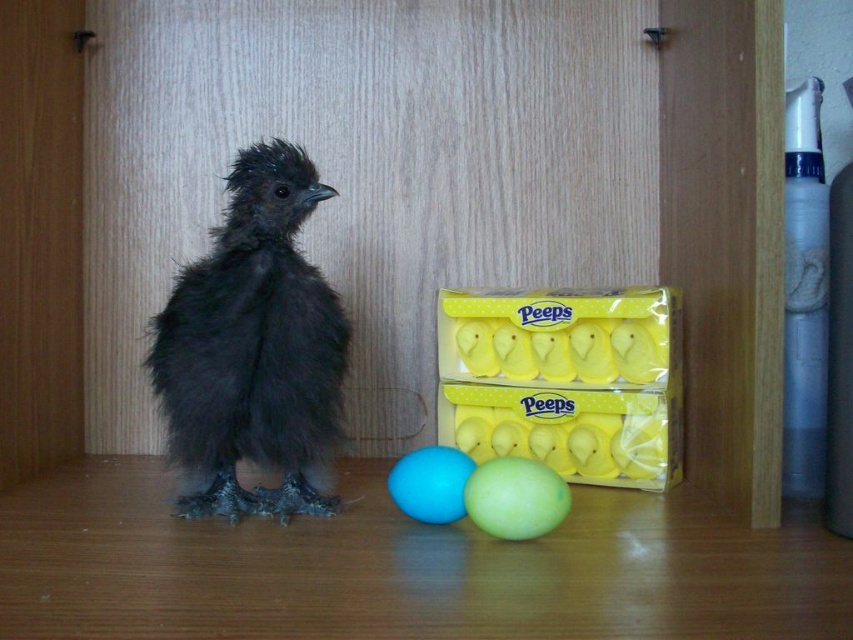
Question: Is green matte egg at center bigger than blue rubber egg at center?

Choices:
 (A) yes
 (B) no

Answer: (A)

Question: Which is nearer to the green matte egg at center?

Choices:
 (A) blue rubber egg at center
 (B) black fluffy bird at left
 (C) yellow matte peeps box at center

Answer: (A)

Question: Which object is farther from the camera taking this photo?

Choices:
 (A) blue rubber egg at center
 (B) yellow matte peeps box at center

Answer: (B)

Question: Among these points, which one is nearest to the camera?

Choices:
 (A) (421, 474)
 (B) (622, 456)
 (C) (271, 204)

Answer: (A)

Question: Is black fluffy bird at left to the left of yellow matte peeps box at center from the viewer's perspective?

Choices:
 (A) yes
 (B) no

Answer: (A)

Question: From the image, what is the correct spatial relationship of green matte egg at center in relation to blue rubber egg at center?

Choices:
 (A) below
 (B) above

Answer: (B)